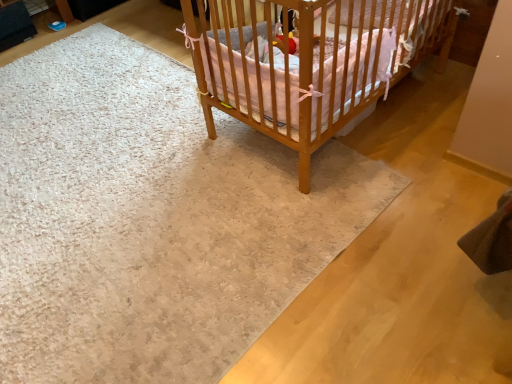
This screenshot has height=384, width=512. In order to click on free location in front of wooden crib at upper right in this screenshot , I will do `click(406, 231)`.